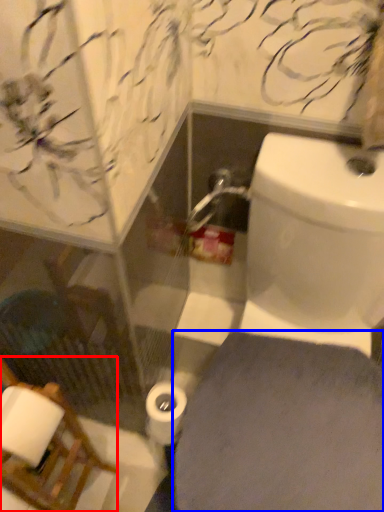
Question: Which object appears farthest to the camera in this image, chair (highlighted by a red box) or porcelain (highlighted by a blue box)?

Choices:
 (A) chair
 (B) porcelain

Answer: (B)